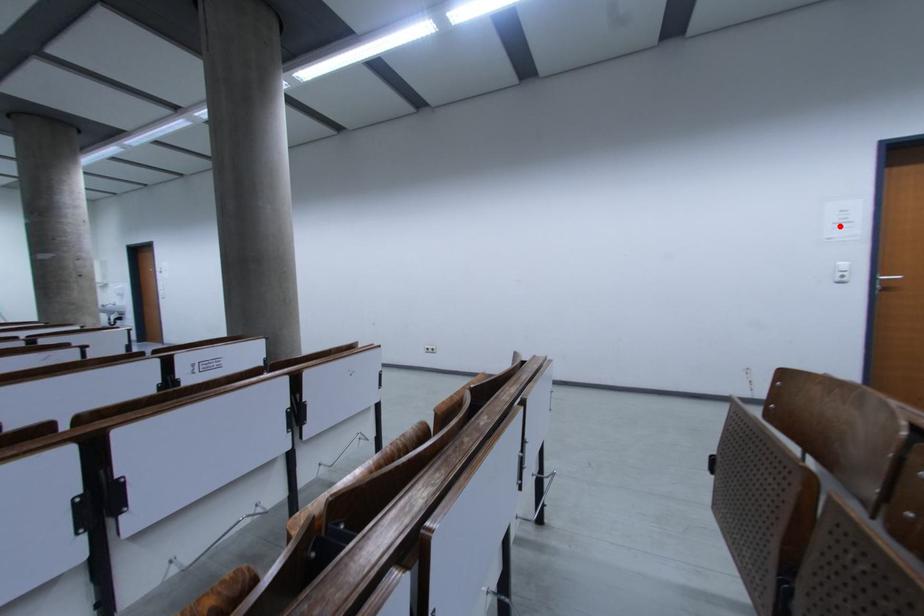
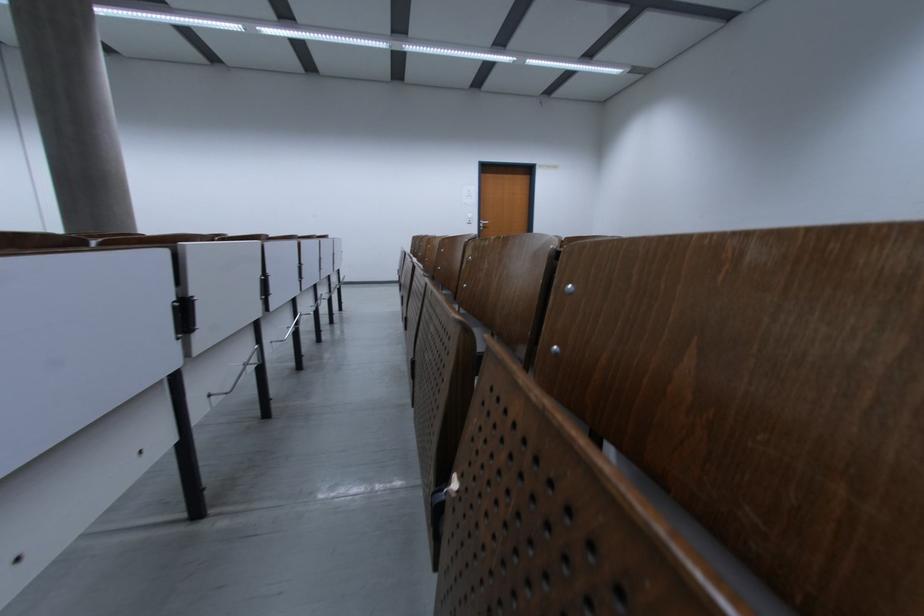
Find the pixel in the second image that matches the highlighted location in the first image.

(470, 199)